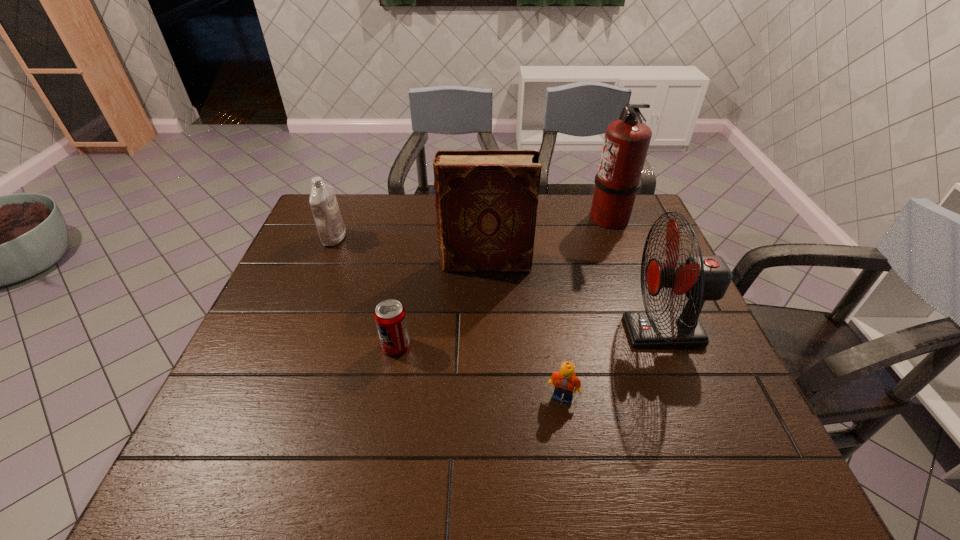
What are the coordinates of `vacant area that lies between the Lego and the hardback book` in the screenshot? It's located at (524, 330).

You are a GUI agent. You are given a task and a screenshot of the screen. Output one action in this format:
    pyautogui.click(x=<x>, y=<y>)
    Task: Click on the third closest object relative to the leftmost object
    
    Given the screenshot: What is the action you would take?
    pyautogui.click(x=564, y=381)

Identify which object is the fourth nearest to the fan. Please provide its 2D coordinates. Your answer should be formatted as a tuple, i.e. [(x, y)], where the tuple contains the x and y coordinates of a point satisfying the conditions above.

[(390, 317)]

This screenshot has height=540, width=960. Find the location of `free space that satisfies the following two spatial constraints: 1. on the front-facing side of the fan; 2. on the front-facing side of the Lego`. free space that satisfies the following two spatial constraints: 1. on the front-facing side of the fan; 2. on the front-facing side of the Lego is located at coordinates (689, 397).

This screenshot has height=540, width=960. Identify the location of vacant space that satisfies the following two spatial constraints: 1. toward the nozzle of the fire extinguisher; 2. on the front-facing side of the Lego. (678, 397).